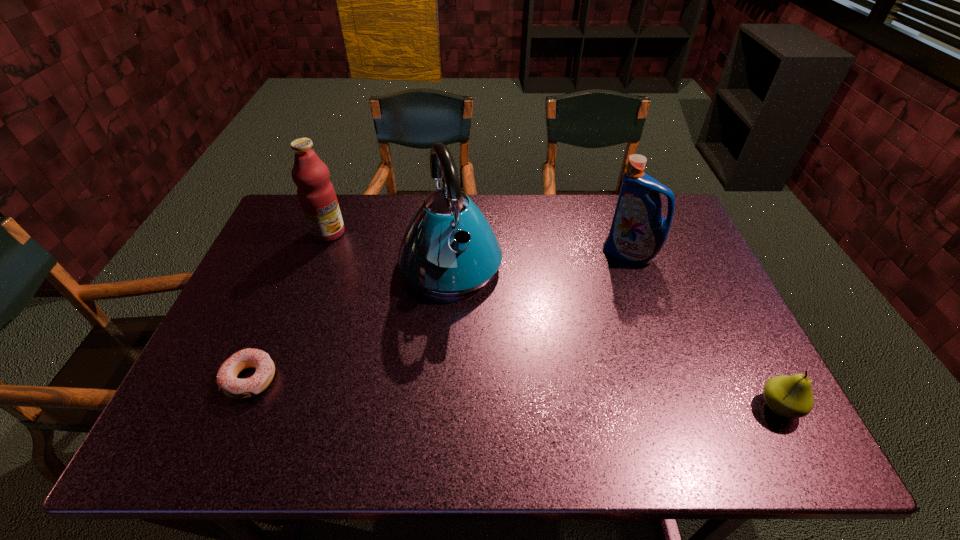
This screenshot has width=960, height=540. I want to click on doughnut, so click(x=227, y=381).

Locate an element on the screen. the second shortest object is located at coordinates (791, 397).

Locate an element on the screen. pear is located at coordinates (791, 397).

Identify the location of the tallest object. (449, 249).

You are a GUI agent. You are given a task and a screenshot of the screen. Output one action in this format:
    pyautogui.click(x=<x>, y=<y>)
    Task: Click on the third object from right to left
    The height and width of the screenshot is (540, 960).
    Given the screenshot: What is the action you would take?
    [x=449, y=249]

Find the location of a particular element. The height and width of the screenshot is (540, 960). fruit juice is located at coordinates (316, 194).

Find the location of `the fourth object from left to right`. the fourth object from left to right is located at coordinates (638, 232).

This screenshot has height=540, width=960. I want to click on vacant area located 0.330m on the back of the doughnut, so click(299, 264).

The height and width of the screenshot is (540, 960). I want to click on free space located 0.280m at the spout of the tallest object, so click(x=502, y=386).

I want to click on vacant region located at the spout of the tallest object, so click(x=502, y=386).